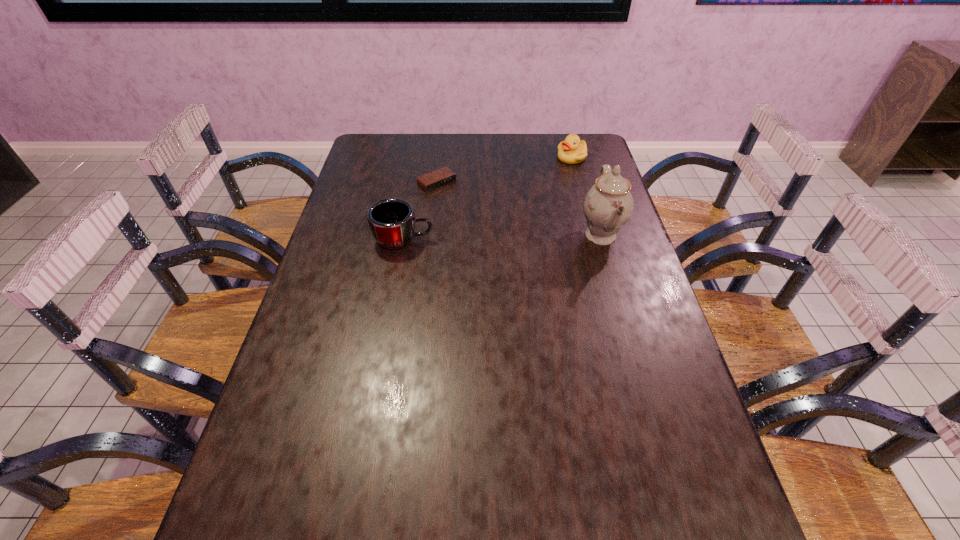
You are a GUI agent. You are given a task and a screenshot of the screen. Output one action in this format:
    pyautogui.click(x=<x>, y=<y>)
    Task: Click on the vacant space that is in between the mug and the farthest object
    The width and height of the screenshot is (960, 540).
    Given the screenshot: What is the action you would take?
    pyautogui.click(x=488, y=199)

You are a GUI agent. You are given a task and a screenshot of the screen. Output one action in this format:
    pyautogui.click(x=<x>, y=<y>)
    Task: Click on the free space between the mug and the duckling
    
    Given the screenshot: What is the action you would take?
    pyautogui.click(x=488, y=199)

This screenshot has height=540, width=960. Identify the location of empty location between the mug and the shortest object. (420, 212).

Identify the location of vacant area between the tallest object and the second farthest object. The image size is (960, 540). (518, 210).

Identify the location of the third closest object to the second farthest object. (608, 205).

At what (x,y) coordinates should I click in order to perform the action: click on object that is the closest to the alarm clock. Please return your answer as a coordinate pair (x, y). This screenshot has width=960, height=540. Looking at the image, I should click on (392, 221).

The height and width of the screenshot is (540, 960). Identify the location of vacant area in the image that satisfies the following two spatial constraints: 1. on the front side of the chinaware; 2. on the spout of the duckling. (593, 235).

The width and height of the screenshot is (960, 540). I want to click on vacant region that satisfies the following two spatial constraints: 1. on the front side of the chinaware; 2. on the spout of the duckling, so click(593, 235).